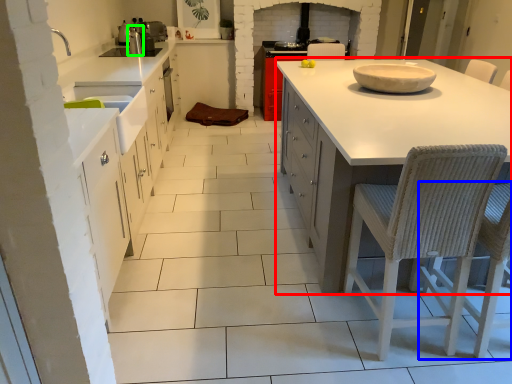
Question: Estimate the real-world distances between objects in this image. Which object is farther from countertop (highlighted by a red box), chair (highlighted by a blue box) or appliance (highlighted by a green box)?

Choices:
 (A) chair
 (B) appliance

Answer: (B)